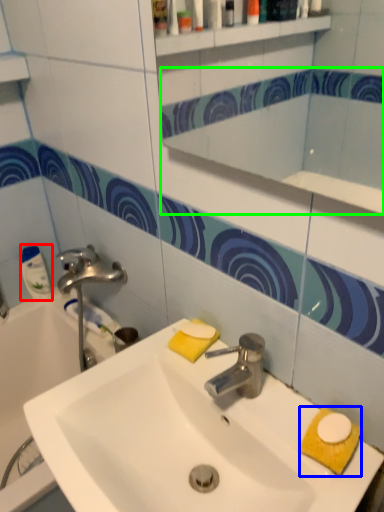
Question: Considering the real-world distances, which object is farthest from cleaning product (highlighted by a red box)? hand towel (highlighted by a blue box) or mirror (highlighted by a green box)?

Choices:
 (A) hand towel
 (B) mirror

Answer: (B)